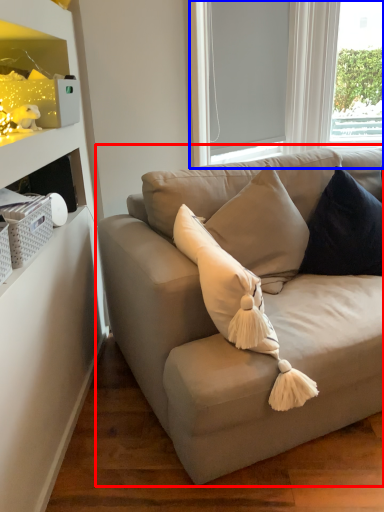
Question: Which object appears closest to the camera in this image, studio couch (highlighted by a red box) or bay window (highlighted by a blue box)?

Choices:
 (A) studio couch
 (B) bay window

Answer: (A)